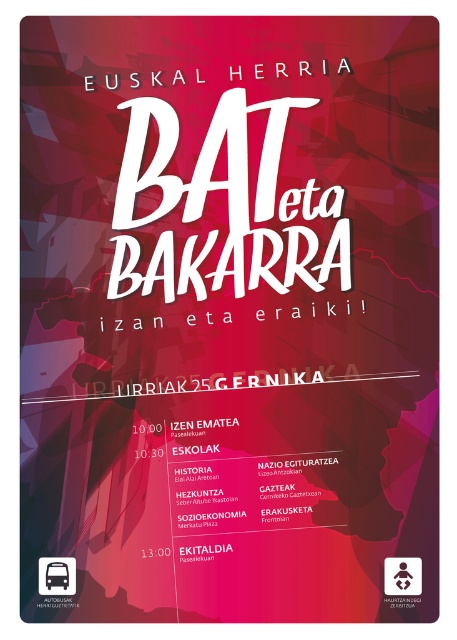
You are standing in front of the promotional poster for the Basque Country event. You see a brushed metal bus at lower left and a white digital clock at center. Which object is positioned closer to you?

The brushed metal bus at lower left is closer to the viewer than the white digital clock at center.

Looking at the promotional poster for the event, you notice a matte red square at center and a brushed metal bus at lower left. Which object takes up more space in the image?

The matte red square at center is bigger than the brushed metal bus at lower left, so it takes up more space in the image.